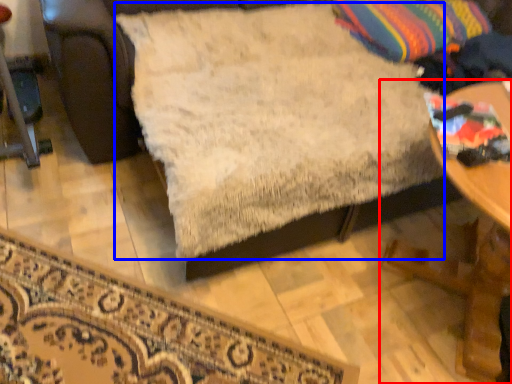
Question: Which point is closer to the camera, table (highlighted by a red box) or sheet (highlighted by a blue box)?

Choices:
 (A) table
 (B) sheet

Answer: (B)